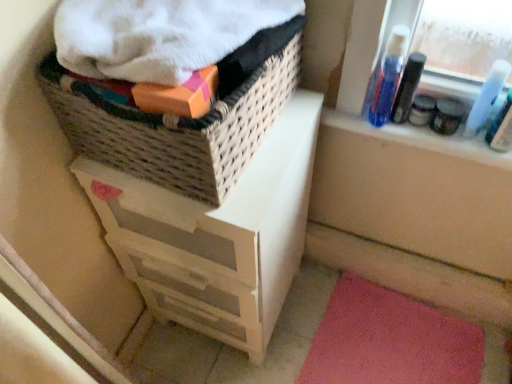
The height and width of the screenshot is (384, 512). In order to click on matte black container at upper right, which is the 1th toiletry from right to left in this screenshot , I will do `click(447, 116)`.

Locate an element on the screen. The width and height of the screenshot is (512, 384). woven brown basket at upper left is located at coordinates (x=179, y=122).

Locate an element on the screen. The height and width of the screenshot is (384, 512). matte black jar at upper right, the 1th toiletry positioned from the left is located at coordinates (421, 110).

What do you see at coordinates (407, 87) in the screenshot?
I see `blue plastic bottle at upper right, the second mouthwash from the left` at bounding box center [407, 87].

In order to face blue plastic bottle at upper right, the 1th mouthwash in the left-to-right sequence, should I rotate leftwards or rightwards?

Turn right by 17.364 degrees to look at blue plastic bottle at upper right, the 1th mouthwash in the left-to-right sequence.

Describe the element at coordinates (390, 341) in the screenshot. I see `pink carpet at lower right` at that location.

The height and width of the screenshot is (384, 512). I want to click on translucent plastic mouthwash at upper right, acting as the first mouthwash starting from the right, so click(486, 97).

Locate an element on the screen. matte black container at upper right, which ranks as the 2th toiletry in left-to-right order is located at coordinates (447, 116).

Which object is thinner, woven brown basket at upper left or translucent plastic mouthwash at upper right, the 3th mouthwash viewed from the left?

translucent plastic mouthwash at upper right, the 3th mouthwash viewed from the left.

Who is shorter, woven brown basket at upper left or translucent plastic mouthwash at upper right, acting as the first mouthwash starting from the right?

translucent plastic mouthwash at upper right, acting as the first mouthwash starting from the right, is shorter.

Is woven brown basket at upper left positioned beyond the bounds of translucent plastic mouthwash at upper right, the 3th mouthwash viewed from the left?

woven brown basket at upper left lies outside translucent plastic mouthwash at upper right, the 3th mouthwash viewed from the left,'s area.

In terms of size, does woven brown basket at upper left appear bigger or smaller than translucent plastic mouthwash at upper right, acting as the first mouthwash starting from the right?

woven brown basket at upper left is bigger than translucent plastic mouthwash at upper right, acting as the first mouthwash starting from the right.

Considering the relative sizes of pink carpet at lower right and woven brown basket at upper left in the image provided, is pink carpet at lower right taller than woven brown basket at upper left?

No, pink carpet at lower right is not taller than woven brown basket at upper left.

Which point is more distant from viewer, [338,317] or [215,174]?

Positioned behind is point [338,317].

Is pink carpet at lower right at the left side of woven brown basket at upper left?

In fact, pink carpet at lower right is to the right of woven brown basket at upper left.

Is woven brown basket at upper left situated inside blue plastic bottle at upper right, the second mouthwash from the left, or outside?

woven brown basket at upper left is not inside blue plastic bottle at upper right, the second mouthwash from the left, it's outside.

Is woven brown basket at upper left bigger or smaller than blue plastic bottle at upper right, the second mouthwash from the left?

In the image, woven brown basket at upper left appears to be larger than blue plastic bottle at upper right, the second mouthwash from the left.

Considering the points (136, 138) and (405, 100), which point is in front, point (136, 138) or point (405, 100)?

The point (136, 138) is more forward.

From the image's perspective, between woven brown basket at upper left and blue plastic bottle at upper right, the second mouthwash from the left, who is located below?

From the image's view, woven brown basket at upper left is below.

In the scene shown: Measure the distance between matte black container at upper right, which is the 1th toiletry from right to left, and pink carpet at lower right.

30.52 inches.

Image resolution: width=512 pixels, height=384 pixels. In order to click on bath mat on the right of the matte black container at upper right, which ranks as the 2th toiletry in left-to-right order in this screenshot , I will do `click(390, 341)`.

Is point (454, 123) positioned after point (470, 369)?

No, it is not.

From the image's perspective, is matte black container at upper right, which ranks as the 2th toiletry in left-to-right order, above pink carpet at lower right?

Indeed, from the image's perspective, matte black container at upper right, which ranks as the 2th toiletry in left-to-right order, is shown above pink carpet at lower right.

Can you confirm if pink carpet at lower right is bigger than translucent plastic mouthwash at upper right, acting as the first mouthwash starting from the right?

Yes.

Which is behind, point (479, 354) or point (502, 81)?

The point (479, 354) is farther from the camera.

How far apart are pink carpet at lower right and translucent plastic mouthwash at upper right, the 3th mouthwash viewed from the left?

pink carpet at lower right and translucent plastic mouthwash at upper right, the 3th mouthwash viewed from the left, are 78.33 centimeters apart from each other.

Looking at this image, in terms of height, does pink carpet at lower right look taller or shorter compared to translucent plastic mouthwash at upper right, the 3th mouthwash viewed from the left?

Clearly, pink carpet at lower right is shorter compared to translucent plastic mouthwash at upper right, the 3th mouthwash viewed from the left.

Would you say woven brown basket at upper left is a long distance from matte black container at upper right, which ranks as the 2th toiletry in left-to-right order?

No, woven brown basket at upper left is not far from matte black container at upper right, which ranks as the 2th toiletry in left-to-right order.

Could you tell me if woven brown basket at upper left is facing matte black container at upper right, which is the 1th toiletry from right to left?

No, woven brown basket at upper left is not turned towards matte black container at upper right, which is the 1th toiletry from right to left.

Between woven brown basket at upper left and matte black container at upper right, which ranks as the 2th toiletry in left-to-right order, which one is positioned in front?

Positioned in front is woven brown basket at upper left.

Between point (172, 146) and point (450, 104), which one is positioned behind?

Point (450, 104)

From the image's perspective, between blue plastic bottle at upper right, acting as the 3th mouthwash starting from the right, and white painted wood chest of drawers at upper left, who is located below?

white painted wood chest of drawers at upper left appears lower in the image.

In the image, is blue plastic bottle at upper right, acting as the 3th mouthwash starting from the right, positioned in front of or behind white painted wood chest of drawers at upper left?

In the image, blue plastic bottle at upper right, acting as the 3th mouthwash starting from the right, appears behind white painted wood chest of drawers at upper left.

Consider the image. Considering the positions of objects blue plastic bottle at upper right, acting as the 3th mouthwash starting from the right, and white painted wood chest of drawers at upper left in the image provided, who is more to the left, blue plastic bottle at upper right, acting as the 3th mouthwash starting from the right, or white painted wood chest of drawers at upper left?

From the viewer's perspective, white painted wood chest of drawers at upper left appears more on the left side.

From a real-world perspective, is blue plastic bottle at upper right, the 1th mouthwash in the left-to-right sequence, located higher than white painted wood chest of drawers at upper left?

Yes, from a real-world perspective, blue plastic bottle at upper right, the 1th mouthwash in the left-to-right sequence, is over white painted wood chest of drawers at upper left

At what (x,y) coordinates should I click in order to perform the action: click on mouthwash below the woven brown basket at upper left (from the image's perspective). Please return your answer as a coordinate pair (x, y). Looking at the image, I should click on (486, 97).

At what (x,y) coordinates should I click in order to perform the action: click on bath mat on the right of woven brown basket at upper left. Please return your answer as a coordinate pair (x, y). This screenshot has height=384, width=512. Looking at the image, I should click on (390, 341).

When comparing their distances from blue plastic bottle at upper right, acting as the 3th mouthwash starting from the right, does woven brown basket at upper left or matte black jar at upper right, the 1th toiletry positioned from the left, seem further?

woven brown basket at upper left is further to blue plastic bottle at upper right, acting as the 3th mouthwash starting from the right.

When comparing their distances from translucent plastic mouthwash at upper right, the 3th mouthwash viewed from the left, does white painted wood chest of drawers at upper left or blue plastic bottle at upper right, the second mouthwash from the left, seem closer?

blue plastic bottle at upper right, the second mouthwash from the left, lies closer to translucent plastic mouthwash at upper right, the 3th mouthwash viewed from the left, than the other object.

Estimate the real-world distances between objects in this image. Which object is closer to white painted wood chest of drawers at upper left, pink carpet at lower right or woven brown basket at upper left?

woven brown basket at upper left is closer to white painted wood chest of drawers at upper left.

Estimate the real-world distances between objects in this image. Which object is further from matte black jar at upper right, the 1th toiletry positioned from the left, white painted wood chest of drawers at upper left or blue plastic bottle at upper right, the second mouthwash from the left?

white painted wood chest of drawers at upper left lies further to matte black jar at upper right, the 1th toiletry positioned from the left, than the other object.

Based on their spatial positions, is translucent plastic mouthwash at upper right, the 3th mouthwash viewed from the left, or white painted wood chest of drawers at upper left closer to blue plastic bottle at upper right, the 2th mouthwash viewed from the right?

The object closer to blue plastic bottle at upper right, the 2th mouthwash viewed from the right, is translucent plastic mouthwash at upper right, the 3th mouthwash viewed from the left.

Which object lies nearer to the anchor point blue plastic bottle at upper right, the 2th mouthwash viewed from the right, translucent plastic mouthwash at upper right, the 3th mouthwash viewed from the left, or matte black jar at upper right, positioned as the second toiletry in right-to-left order?

matte black jar at upper right, positioned as the second toiletry in right-to-left order, is positioned closer to the anchor blue plastic bottle at upper right, the 2th mouthwash viewed from the right.

In the scene shown: Considering their positions, is pink carpet at lower right positioned further to blue plastic bottle at upper right, acting as the 3th mouthwash starting from the right, than matte black container at upper right, which ranks as the 2th toiletry in left-to-right order?

pink carpet at lower right is positioned further to the anchor blue plastic bottle at upper right, acting as the 3th mouthwash starting from the right.

Based on their spatial positions, is matte black jar at upper right, the 1th toiletry positioned from the left, or blue plastic bottle at upper right, acting as the 3th mouthwash starting from the right, closer to matte black container at upper right, which ranks as the 2th toiletry in left-to-right order?

matte black jar at upper right, the 1th toiletry positioned from the left, lies closer to matte black container at upper right, which ranks as the 2th toiletry in left-to-right order, than the other object.

Identify the location of mouthwash between woven brown basket at upper left and blue plastic bottle at upper right, the second mouthwash from the left, in the horizontal direction. The height and width of the screenshot is (384, 512). (388, 76).

I want to click on toiletry between blue plastic bottle at upper right, the 2th mouthwash viewed from the right, and matte black container at upper right, which is the 1th toiletry from right to left, so click(421, 110).

You are a GUI agent. You are given a task and a screenshot of the screen. Output one action in this format:
    pyautogui.click(x=<x>, y=<y>)
    Task: Click on the chest of drawers between woven brown basket at upper left and matte black jar at upper right, positioned as the second toiletry in right-to-left order
    The height and width of the screenshot is (384, 512).
    Given the screenshot: What is the action you would take?
    pyautogui.click(x=217, y=235)

Locate an element on the screen. the chest of drawers located between woven brown basket at upper left and translucent plastic mouthwash at upper right, the 3th mouthwash viewed from the left, in the left-right direction is located at coordinates (217, 235).